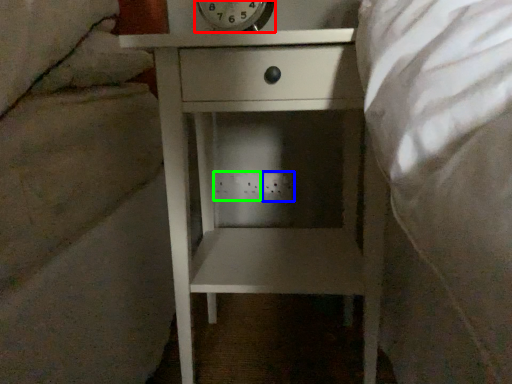
Question: Which object is positioned farthest from alarm clock (highlighted by a red box)? Select from electric outlet (highlighted by a blue box) and electric outlet (highlighted by a green box).

Choices:
 (A) electric outlet
 (B) electric outlet

Answer: (A)